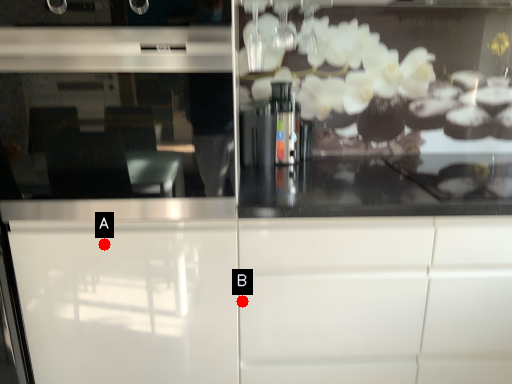
Question: Two points are circled on the image, labeled by A and B beside each circle. Among these points, which one is farthest from the camera?

Choices:
 (A) A is further
 (B) B is further

Answer: (B)